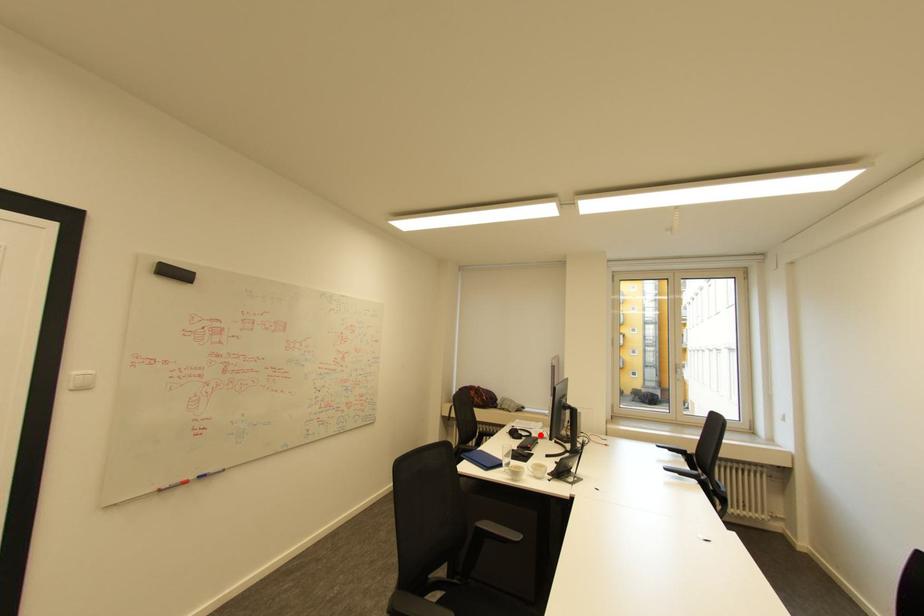
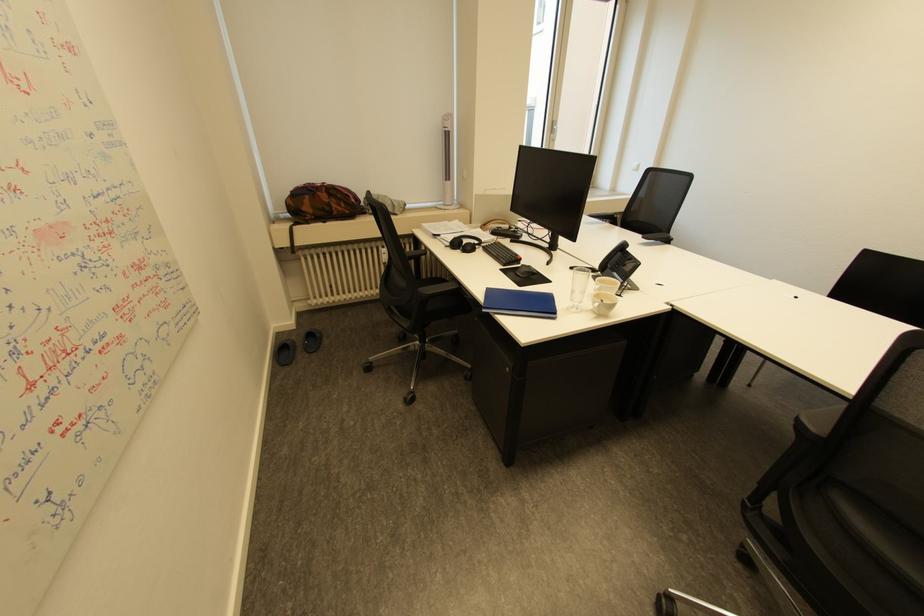
Locate, in the second image, the point that corresponds to the highlighted location in the first image.

(490, 240)